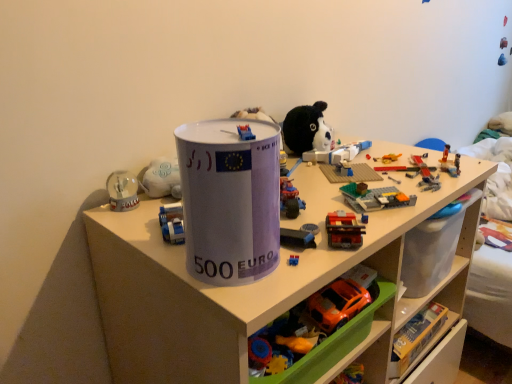
Where is `white plastic shelf at center`? This screenshot has height=384, width=512. white plastic shelf at center is located at coordinates (228, 287).

This screenshot has height=384, width=512. Describe the element at coordinates (337, 304) in the screenshot. I see `orange plastic car at lower center, which is the third toy from top to bottom` at that location.

Find the location of a particular element. Image resolution: width=512 pixels, height=384 pixels. orange plastic car at lower center, the first toy in the bottom-to-top sequence is located at coordinates (328, 350).

Image resolution: width=512 pixels, height=384 pixels. In order to click on brick-like plastic train at center-right, the third toy when ordered from bottom to top in this screenshot , I will do `click(344, 230)`.

Measure the distance between point (333, 219) and camera.

The distance of point (333, 219) from camera is 30.59 inches.

I want to click on white plastic shelf at center, so click(x=228, y=287).

Is the position of brick-like plastic train at center-right, the second toy positioned from the top, less distant than that of orange plastic car at lower center, the fourth toy positioned from the top?

No, brick-like plastic train at center-right, the second toy positioned from the top, is further to the viewer.

Measure the distance between brick-like plastic train at center-right, the third toy when ordered from bottom to top, and orange plastic car at lower center, the fourth toy positioned from the top.

brick-like plastic train at center-right, the third toy when ordered from bottom to top, is 7.93 inches from orange plastic car at lower center, the fourth toy positioned from the top.

Based on their sizes in the image, would you say brick-like plastic train at center-right, the second toy positioned from the top, is bigger or smaller than orange plastic car at lower center, the fourth toy positioned from the top?

brick-like plastic train at center-right, the second toy positioned from the top, is smaller than orange plastic car at lower center, the fourth toy positioned from the top.

Considering the sizes of objects rubberized plastic toy car at center, which is the 1th toy from top to bottom, and orange plastic car at lower center, the fourth toy positioned from the top, in the image provided, who is shorter, rubberized plastic toy car at center, which is the 1th toy from top to bottom, or orange plastic car at lower center, the fourth toy positioned from the top,?

Standing shorter between the two is rubberized plastic toy car at center, which is the 1th toy from top to bottom.

Consider the image. Is rubberized plastic toy car at center, which appears as the 4th toy when ordered from the bottom, far away from orange plastic car at lower center, the first toy in the bottom-to-top sequence?

No, rubberized plastic toy car at center, which appears as the 4th toy when ordered from the bottom, is not far away from orange plastic car at lower center, the first toy in the bottom-to-top sequence.

Is rubberized plastic toy car at center, which is the 1th toy from top to bottom, not inside orange plastic car at lower center, the first toy in the bottom-to-top sequence?

Indeed, rubberized plastic toy car at center, which is the 1th toy from top to bottom, is completely outside orange plastic car at lower center, the first toy in the bottom-to-top sequence.

Is rubberized plastic toy car at center, which is the 1th toy from top to bottom, facing away from orange plastic car at lower center, the fourth toy positioned from the top?

rubberized plastic toy car at center, which is the 1th toy from top to bottom, does not have its back to orange plastic car at lower center, the fourth toy positioned from the top.

From a real-world perspective, is orange plastic car at lower center, the 2th toy positioned from the bottom, located higher than white plastic shelf at center?

Yes, from a real-world perspective, orange plastic car at lower center, the 2th toy positioned from the bottom, is over white plastic shelf at center

Considering the sizes of objects orange plastic car at lower center, which is the third toy from top to bottom, and white plastic shelf at center in the image provided, who is smaller, orange plastic car at lower center, which is the third toy from top to bottom, or white plastic shelf at center?

With smaller size is orange plastic car at lower center, which is the third toy from top to bottom.

Is point (306, 304) positioned in front of point (161, 361)?

That is False.

Can you tell me how much orange plastic car at lower center, which is the third toy from top to bottom, and white plastic shelf at center differ in facing direction?

The facing directions of orange plastic car at lower center, which is the third toy from top to bottom, and white plastic shelf at center are 2.84 degrees apart.

Considering the sizes of objects orange plastic car at lower center, which is the third toy from top to bottom, and orange plastic car at lower center, the fourth toy positioned from the top, in the image provided, who is smaller, orange plastic car at lower center, which is the third toy from top to bottom, or orange plastic car at lower center, the fourth toy positioned from the top,?

orange plastic car at lower center, which is the third toy from top to bottom, is smaller.

Does orange plastic car at lower center, which is the third toy from top to bottom, touch orange plastic car at lower center, the first toy in the bottom-to-top sequence?

Yes, orange plastic car at lower center, which is the third toy from top to bottom, is with orange plastic car at lower center, the first toy in the bottom-to-top sequence.

From a real-world perspective, relative to orange plastic car at lower center, the first toy in the bottom-to-top sequence, is orange plastic car at lower center, the 2th toy positioned from the bottom, vertically above or below?

From a real-world perspective, orange plastic car at lower center, the 2th toy positioned from the bottom, is physically above orange plastic car at lower center, the first toy in the bottom-to-top sequence.

Is orange plastic car at lower center, which is the third toy from top to bottom, turned away from orange plastic car at lower center, the fourth toy positioned from the top?

Correct, orange plastic car at lower center, which is the third toy from top to bottom, is looking away from orange plastic car at lower center, the fourth toy positioned from the top.

Is brick-like plastic train at center-right, the third toy when ordered from bottom to top, located within white paper cup at center?

Definitely not — brick-like plastic train at center-right, the third toy when ordered from bottom to top, is not inside white paper cup at center.

Based on the photo, is brick-like plastic train at center-right, the third toy when ordered from bottom to top, at the back of white paper cup at center?

No, white paper cup at center is not facing the opposite direction of brick-like plastic train at center-right, the third toy when ordered from bottom to top.

Who is shorter, white paper cup at center or brick-like plastic train at center-right, the second toy positioned from the top?

With less height is brick-like plastic train at center-right, the second toy positioned from the top.

From a real-world perspective, is white paper cup at center physically located above or below brick-like plastic train at center-right, the third toy when ordered from bottom to top?

white paper cup at center is situated higher than brick-like plastic train at center-right, the third toy when ordered from bottom to top, in the real world.

In the scene shown: From the image's perspective, between orange plastic car at lower center, the 2th toy positioned from the bottom, and rubberized plastic toy car at center, which appears as the 4th toy when ordered from the bottom, who is located below?

orange plastic car at lower center, the 2th toy positioned from the bottom.

Is orange plastic car at lower center, which is the third toy from top to bottom, aimed at rubberized plastic toy car at center, which is the 1th toy from top to bottom?

No, orange plastic car at lower center, which is the third toy from top to bottom, does not turn towards rubberized plastic toy car at center, which is the 1th toy from top to bottom.

Consider the image. Visually, is orange plastic car at lower center, which is the third toy from top to bottom, positioned to the left or to the right of rubberized plastic toy car at center, which is the 1th toy from top to bottom?

orange plastic car at lower center, which is the third toy from top to bottom, is to the right of rubberized plastic toy car at center, which is the 1th toy from top to bottom.

Can you confirm if orange plastic car at lower center, which is the third toy from top to bottom, is shorter than rubberized plastic toy car at center, which is the 1th toy from top to bottom?

Indeed, orange plastic car at lower center, which is the third toy from top to bottom, has a lesser height compared to rubberized plastic toy car at center, which is the 1th toy from top to bottom.

Is orange plastic car at lower center, the first toy in the bottom-to-top sequence, completely or partially outside of brick-like plastic train at center-right, the second toy positioned from the top?

Yes, orange plastic car at lower center, the first toy in the bottom-to-top sequence, is outside of brick-like plastic train at center-right, the second toy positioned from the top.

Is orange plastic car at lower center, the first toy in the bottom-to-top sequence, facing towards brick-like plastic train at center-right, the third toy when ordered from bottom to top?

No, orange plastic car at lower center, the first toy in the bottom-to-top sequence, does not turn towards brick-like plastic train at center-right, the third toy when ordered from bottom to top.

Measure the distance from orange plastic car at lower center, the first toy in the bottom-to-top sequence, to brick-like plastic train at center-right, the second toy positioned from the top.

orange plastic car at lower center, the first toy in the bottom-to-top sequence, and brick-like plastic train at center-right, the second toy positioned from the top, are 20.15 centimeters apart.

Which is behind, point (328, 353) or point (337, 246)?

The point (328, 353) is farther from the camera.

This screenshot has height=384, width=512. What are the coordinates of `toy that is the 2nd one when counting upward from the orange plastic car at lower center, the fourth toy positioned from the top (from the image's perspective)` in the screenshot? It's located at (x=344, y=230).

Where is `the 3rd toy below the rubberized plastic toy car at center, which is the 1th toy from top to bottom (from the image's perspective)`? This screenshot has height=384, width=512. the 3rd toy below the rubberized plastic toy car at center, which is the 1th toy from top to bottom (from the image's perspective) is located at coordinates (328, 350).

Considering their positions, is orange plastic car at lower center, the 2th toy positioned from the bottom, positioned further to white paper cup at center than orange plastic car at lower center, the fourth toy positioned from the top?

The object further to white paper cup at center is orange plastic car at lower center, the 2th toy positioned from the bottom.

When comparing their distances from orange plastic car at lower center, which is the third toy from top to bottom, does brick-like plastic train at center-right, the second toy positioned from the top, or white plastic shelf at center seem further?

white plastic shelf at center is positioned further to the anchor orange plastic car at lower center, which is the third toy from top to bottom.

Looking at this image, which object lies nearer to the anchor point orange plastic car at lower center, the fourth toy positioned from the top, white paper cup at center or white plastic shelf at center?

white plastic shelf at center is positioned closer to the anchor orange plastic car at lower center, the fourth toy positioned from the top.

Consider the image. When comparing their distances from white paper cup at center, does orange plastic car at lower center, the first toy in the bottom-to-top sequence, or white plastic shelf at center seem further?

The object further to white paper cup at center is orange plastic car at lower center, the first toy in the bottom-to-top sequence.

From the image, which object appears to be nearer to orange plastic car at lower center, the fourth toy positioned from the top, brick-like plastic train at center-right, the second toy positioned from the top, or orange plastic car at lower center, which is the third toy from top to bottom?

orange plastic car at lower center, which is the third toy from top to bottom, lies closer to orange plastic car at lower center, the fourth toy positioned from the top, than the other object.

Considering their positions, is white plastic shelf at center positioned closer to rubberized plastic toy car at center, which is the 1th toy from top to bottom, than white paper cup at center?

white paper cup at center.

From the picture: When comparing their distances from rubberized plastic toy car at center, which appears as the 4th toy when ordered from the bottom, does orange plastic car at lower center, the first toy in the bottom-to-top sequence, or brick-like plastic train at center-right, the second toy positioned from the top, seem closer?

Among the two, brick-like plastic train at center-right, the second toy positioned from the top, is located nearer to rubberized plastic toy car at center, which appears as the 4th toy when ordered from the bottom.

Which object lies further to the anchor point rubberized plastic toy car at center, which is the 1th toy from top to bottom, orange plastic car at lower center, the first toy in the bottom-to-top sequence, or orange plastic car at lower center, which is the third toy from top to bottom?

orange plastic car at lower center, the first toy in the bottom-to-top sequence, lies further to rubberized plastic toy car at center, which is the 1th toy from top to bottom, than the other object.

Locate an element on the screen. The image size is (512, 384). paper cup between rubberized plastic toy car at center, which appears as the 4th toy when ordered from the bottom, and orange plastic car at lower center, the fourth toy positioned from the top, in the up-down direction is located at coordinates (230, 200).

Locate an element on the screen. paper cup between rubberized plastic toy car at center, which appears as the 4th toy when ordered from the bottom, and white plastic shelf at center in the up-down direction is located at coordinates (230, 200).

Where is `toy between rubberized plastic toy car at center, which appears as the 4th toy when ordered from the bottom, and orange plastic car at lower center, which is the third toy from top to bottom, in the vertical direction`? toy between rubberized plastic toy car at center, which appears as the 4th toy when ordered from the bottom, and orange plastic car at lower center, which is the third toy from top to bottom, in the vertical direction is located at coordinates [x=344, y=230].

Identify the location of toy between brick-like plastic train at center-right, the second toy positioned from the top, and orange plastic car at lower center, the fourth toy positioned from the top, vertically. (337, 304).